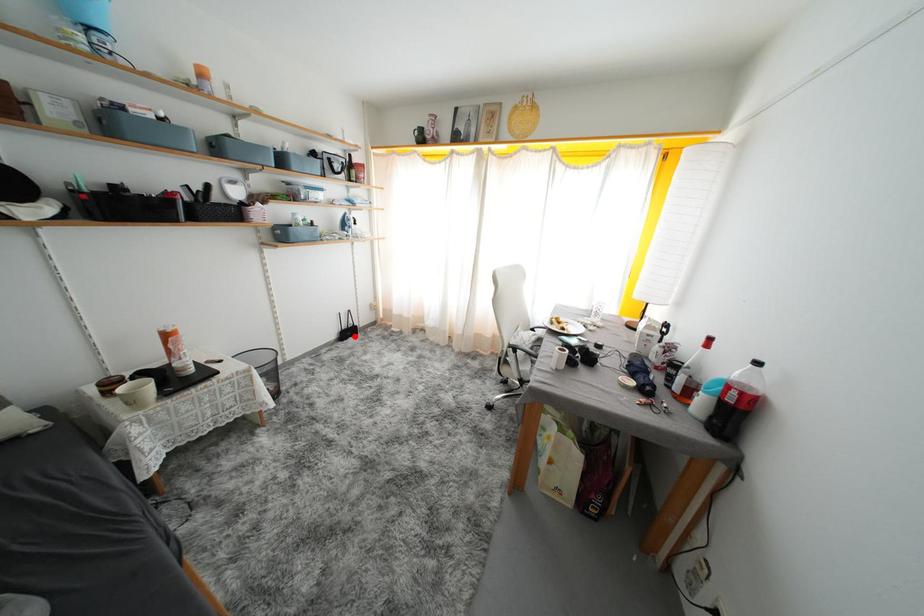
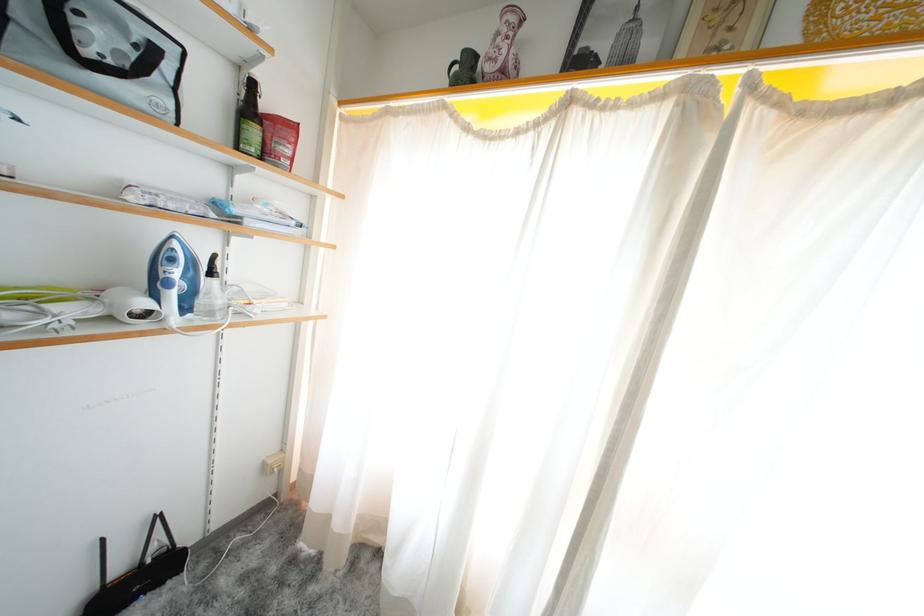
Find the pixel in the second image that matches the highlighted location in the first image.

(143, 586)